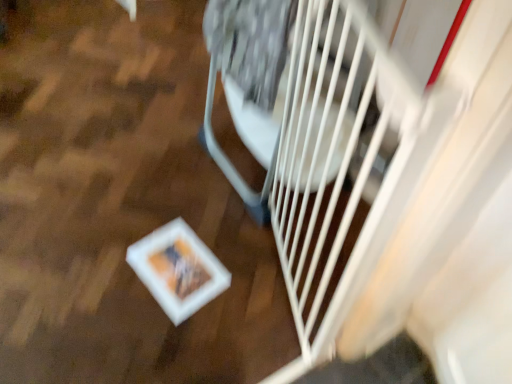
Question: Looking at the image, does white matte gate at center seem bigger or smaller compared to white plastic gate at right?

Choices:
 (A) big
 (B) small

Answer: (B)

Question: Is point [102, 61] positioned closer to the camera than point [245, 41]?

Choices:
 (A) farther
 (B) closer

Answer: (A)

Question: From the image's perspective, is white matte gate at center positioned above or below white plastic gate at right?

Choices:
 (A) above
 (B) below

Answer: (A)

Question: From a real-world perspective, relative to white matte gate at center, is white plastic gate at right vertically above or below?

Choices:
 (A) below
 (B) above

Answer: (B)

Question: Is point [x=274, y=97] closer or farther from the camera than point [x=52, y=215]?

Choices:
 (A) closer
 (B) farther

Answer: (A)

Question: Relative to white matte gate at center, is white plastic gate at right in front or behind?

Choices:
 (A) front
 (B) behind

Answer: (A)

Question: In the image, is white plastic gate at right on the left side or the right side of white matte gate at center?

Choices:
 (A) left
 (B) right

Answer: (B)